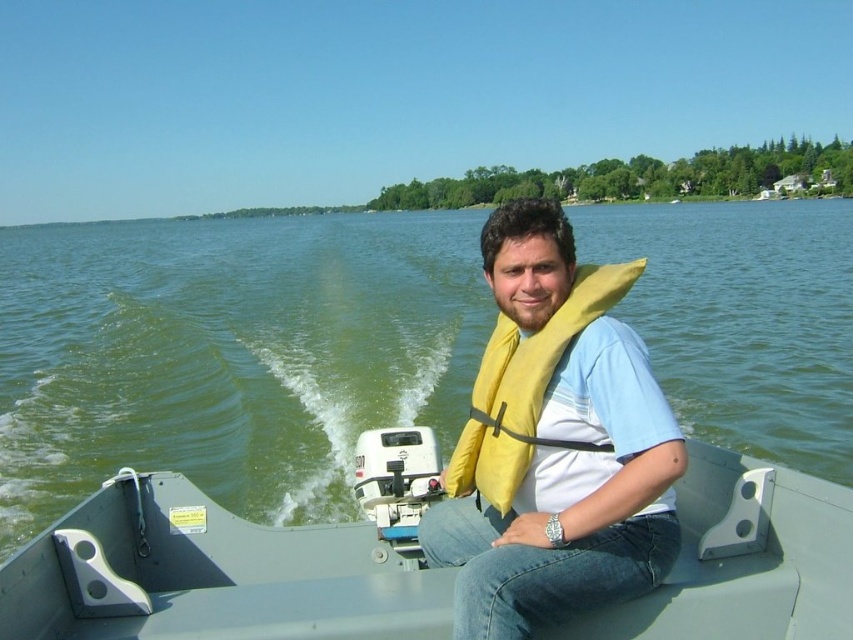
Question: Can you confirm if green water at center is bigger than yellow fabric life vest at center?

Choices:
 (A) yes
 (B) no

Answer: (A)

Question: Which object appears closest to the camera in this image?

Choices:
 (A) yellow fabric life jacket at center
 (B) green water at center
 (C) metallic gray boat at center
 (D) yellow fabric life vest at center

Answer: (D)

Question: Can you confirm if metallic gray boat at center is positioned above yellow fabric life vest at center?

Choices:
 (A) yes
 (B) no

Answer: (B)

Question: Which point is closer to the camera?

Choices:
 (A) yellow fabric life jacket at center
 (B) metallic gray boat at center

Answer: (A)

Question: Among these objects, which one is nearest to the camera?

Choices:
 (A) metallic gray boat at center
 (B) yellow fabric life jacket at center
 (C) green water at center
 (D) yellow fabric life vest at center

Answer: (D)

Question: Considering the relative positions of green water at center and yellow fabric life jacket at center in the image provided, where is green water at center located with respect to yellow fabric life jacket at center?

Choices:
 (A) above
 (B) below

Answer: (A)